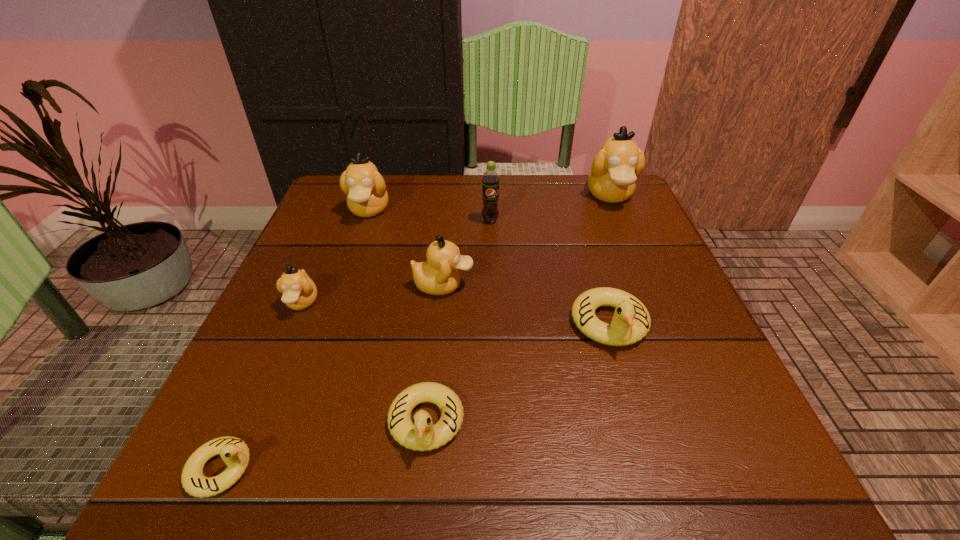
In order to click on vacant space that is in between the fourth tallest object and the sixth object from left to right in this screenshot , I will do `click(467, 253)`.

Find the location of a particular element. free space between the farthest yellow duckling and the second smallest yellow duckling is located at coordinates (517, 373).

Where is `free space that is in between the third object from right to left and the shortest object`? This screenshot has width=960, height=540. free space that is in between the third object from right to left and the shortest object is located at coordinates (356, 345).

Locate an element on the screen. vacant space that's between the smallest yellow duckling and the smallest tan duckling is located at coordinates (262, 386).

Locate an element on the screen. unoccupied area between the second biggest yellow duckling and the second biggest tan duckling is located at coordinates (397, 316).

Locate an element on the screen. This screenshot has height=540, width=960. unoccupied position between the biggest tan duckling and the fifth shortest duckling is located at coordinates (527, 240).

This screenshot has width=960, height=540. I want to click on vacant space that's between the biggest yellow duckling and the second shortest object, so click(517, 373).

Locate an element on the screen. empty space that is in between the second tan duckling from right to left and the rightmost yellow duckling is located at coordinates (527, 305).

This screenshot has width=960, height=540. Identify the location of free spot between the tallest duckling and the smallest yellow duckling. (416, 332).

Image resolution: width=960 pixels, height=540 pixels. Identify the location of vacant area between the smallest tan duckling and the sixth tallest duckling. 364,362.